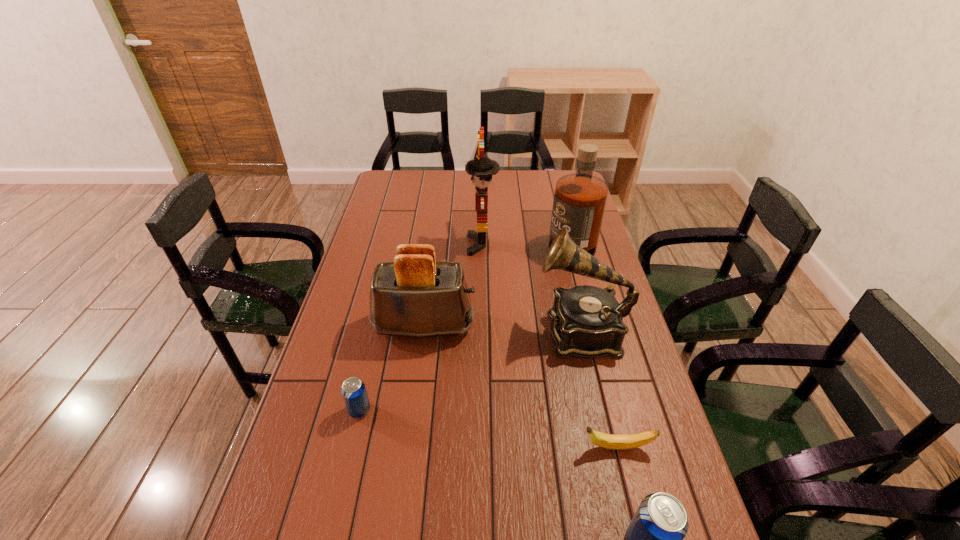
Please mark a free spot for a new beer_can to balance the arrangement. Please provide its 2D coordinates. Your answer should be formatted as a tuple, i.e. [(x, y)], where the tuple contains the x and y coordinates of a point satisfying the conditions above.

[(486, 470)]